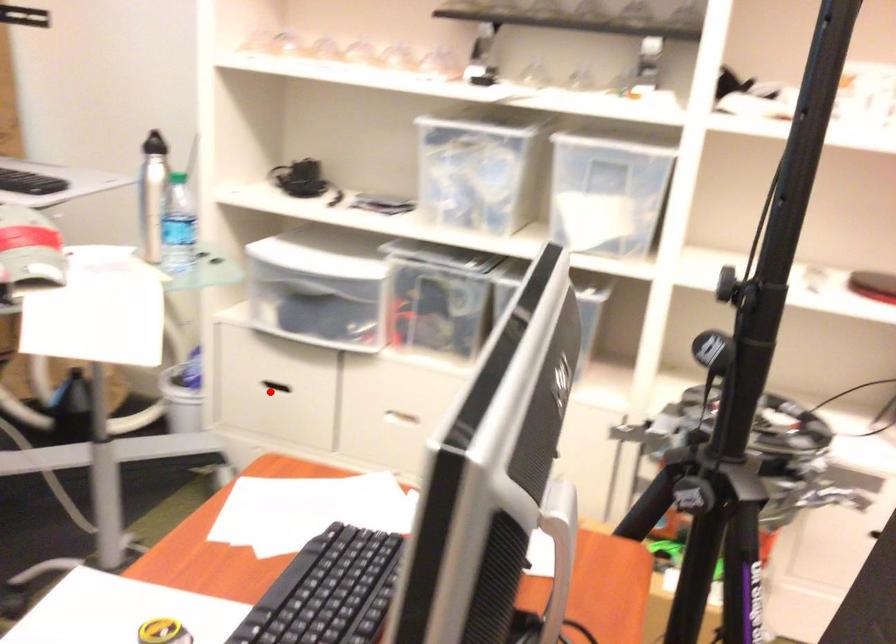
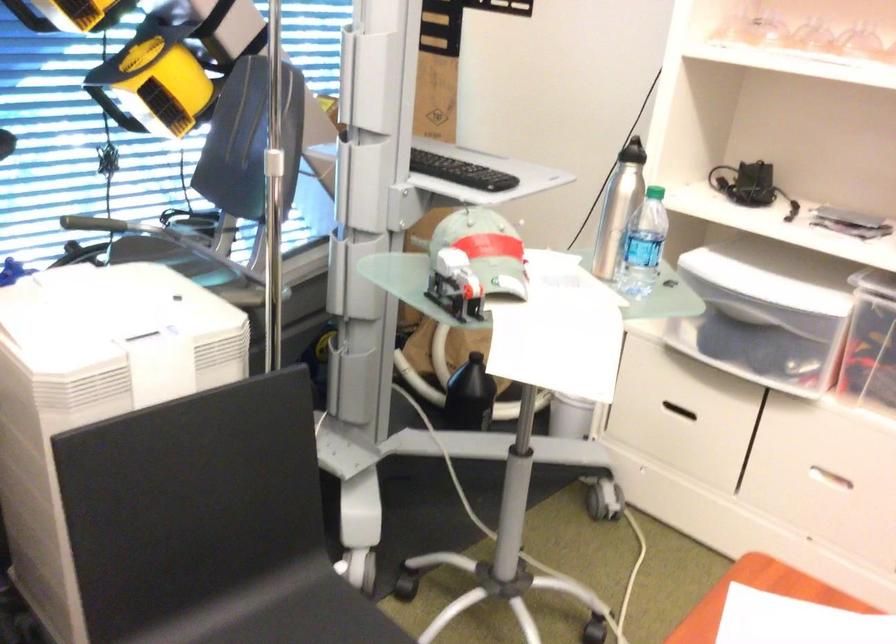
Where in the second image is the point corresponding to the highlighted location from the first image?

(677, 411)